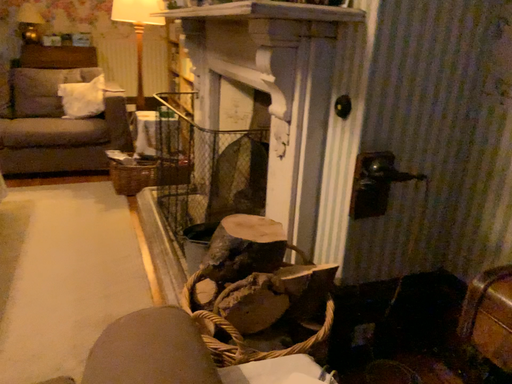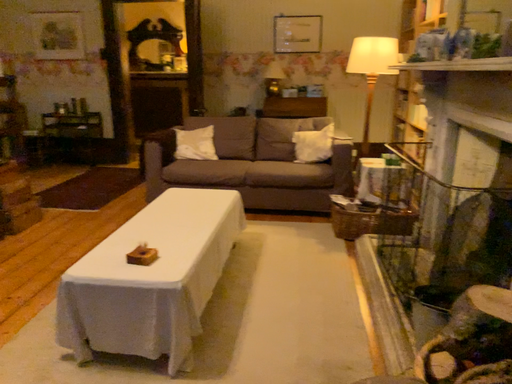
Question: Which way did the camera rotate in the video?

Choices:
 (A) rotated upward
 (B) rotated downward

Answer: (A)